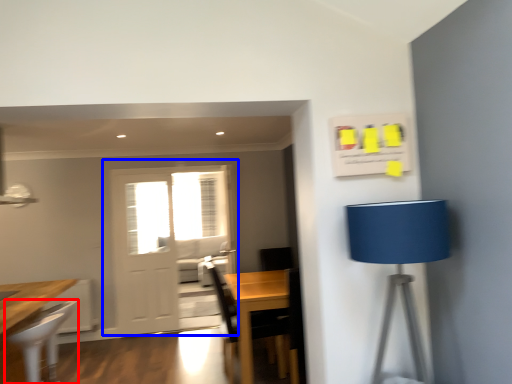
Question: Which object appears closest to the camera in this image, chair (highlighted by a red box) or door (highlighted by a blue box)?

Choices:
 (A) chair
 (B) door

Answer: (A)